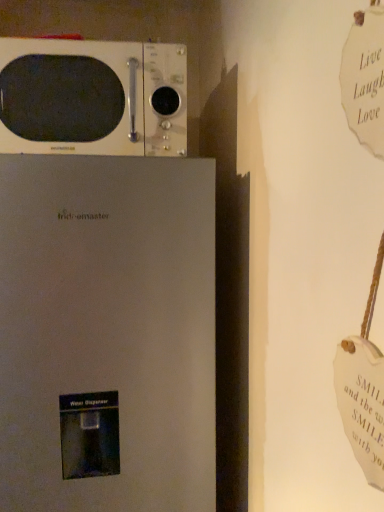
At what (x,y) coordinates should I click in order to perform the action: click on satin white refrigerator at lower left. Please return your answer as a coordinate pair (x, y). This screenshot has height=512, width=384. Looking at the image, I should click on (107, 333).

Image resolution: width=384 pixels, height=512 pixels. Describe the element at coordinates (107, 333) in the screenshot. I see `satin white refrigerator at lower left` at that location.

What is the approximate width of white glossy microwave at upper left?

The width of white glossy microwave at upper left is 12.26 inches.

The height and width of the screenshot is (512, 384). In order to click on white glossy microwave at upper left in this screenshot , I will do (92, 97).

This screenshot has width=384, height=512. What do you see at coordinates (92, 97) in the screenshot? I see `white glossy microwave at upper left` at bounding box center [92, 97].

Where is `satin white refrigerator at lower left`? The image size is (384, 512). satin white refrigerator at lower left is located at coordinates (107, 333).

Considering the relative positions of satin white refrigerator at lower left and white glossy microwave at upper left in the image provided, is satin white refrigerator at lower left to the left of white glossy microwave at upper left from the viewer's perspective?

Correct, you'll find satin white refrigerator at lower left to the left of white glossy microwave at upper left.

Does satin white refrigerator at lower left lie behind white glossy microwave at upper left?

No, satin white refrigerator at lower left is closer to the viewer.

Is point (47, 164) farther from viewer compared to point (54, 121)?

No, it is in front of (54, 121).

From the image's perspective, which is above, satin white refrigerator at lower left or white glossy microwave at upper left?

white glossy microwave at upper left, from the image's perspective.

From a real-world perspective, relative to white glossy microwave at upper left, is satin white refrigerator at lower left vertically above or below?

Clearly, from a real-world perspective, satin white refrigerator at lower left is below white glossy microwave at upper left.

Which of these two, satin white refrigerator at lower left or white glossy microwave at upper left, is thinner?

With smaller width is white glossy microwave at upper left.

Consider the image. Can you confirm if satin white refrigerator at lower left is shorter than white glossy microwave at upper left?

In fact, satin white refrigerator at lower left may be taller than white glossy microwave at upper left.

Which of these two, satin white refrigerator at lower left or white glossy microwave at upper left, is bigger?

Bigger between the two is satin white refrigerator at lower left.

Is white glossy microwave at upper left located within satin white refrigerator at lower left?

Definitely not — white glossy microwave at upper left is not inside satin white refrigerator at lower left.

Are satin white refrigerator at lower left and white glossy microwave at upper left located far from each other?

They are positioned close to each other.

Could you tell me if satin white refrigerator at lower left is turned towards white glossy microwave at upper left?

No, satin white refrigerator at lower left is not facing towards white glossy microwave at upper left.

Can you tell me how much satin white refrigerator at lower left and white glossy microwave at upper left differ in facing direction?

The angle between the facing direction of satin white refrigerator at lower left and the facing direction of white glossy microwave at upper left is 2.64 degrees.

Find the location of `microwave oven on the right of the satin white refrigerator at lower left`. microwave oven on the right of the satin white refrigerator at lower left is located at coordinates (92, 97).

Is white glossy microwave at upper left to the right of satin white refrigerator at lower left from the viewer's perspective?

Indeed, white glossy microwave at upper left is positioned on the right side of satin white refrigerator at lower left.

Consider the image. Is white glossy microwave at upper left behind satin white refrigerator at lower left?

Yes, white glossy microwave at upper left is behind satin white refrigerator at lower left.

Is point (120, 137) closer to camera compared to point (6, 164)?

No, it is not.

From the image's perspective, which is below, white glossy microwave at upper left or satin white refrigerator at lower left?

satin white refrigerator at lower left appears lower in the image.

From a real-world perspective, which object rests below the other?

satin white refrigerator at lower left, from a real-world perspective.

Considering the sizes of objects white glossy microwave at upper left and satin white refrigerator at lower left in the image provided, who is thinner, white glossy microwave at upper left or satin white refrigerator at lower left?

white glossy microwave at upper left is thinner.

Is white glossy microwave at upper left taller than satin white refrigerator at lower left?

No.

Does white glossy microwave at upper left have a smaller size compared to satin white refrigerator at lower left?

Indeed, white glossy microwave at upper left has a smaller size compared to satin white refrigerator at lower left.

Is white glossy microwave at upper left situated inside satin white refrigerator at lower left or outside?

The correct answer is: outside.

Are white glossy microwave at upper left and satin white refrigerator at lower left beside each other?

No, white glossy microwave at upper left is not next to satin white refrigerator at lower left.

Is white glossy microwave at upper left facing away from satin white refrigerator at lower left?

No.

How many degrees apart are the facing directions of white glossy microwave at upper left and satin white refrigerator at lower left?

2.64 degrees separate the facing orientations of white glossy microwave at upper left and satin white refrigerator at lower left.

Identify the location of microwave oven on the right of satin white refrigerator at lower left. This screenshot has width=384, height=512. (92, 97).

Where is `refrigerator below the white glossy microwave at upper left (from a real-world perspective)`? refrigerator below the white glossy microwave at upper left (from a real-world perspective) is located at coordinates (107, 333).

The image size is (384, 512). What are the coordinates of `refrigerator lying in front of the white glossy microwave at upper left` in the screenshot? It's located at (107, 333).